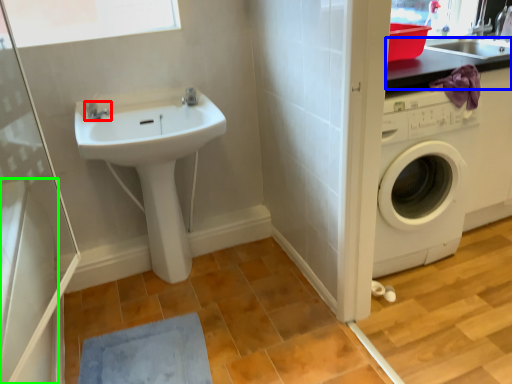
Question: Considering the real-world distances, which object is farthest from tap (highlighted by a red box)? counter top (highlighted by a blue box) or appliance (highlighted by a green box)?

Choices:
 (A) counter top
 (B) appliance

Answer: (A)